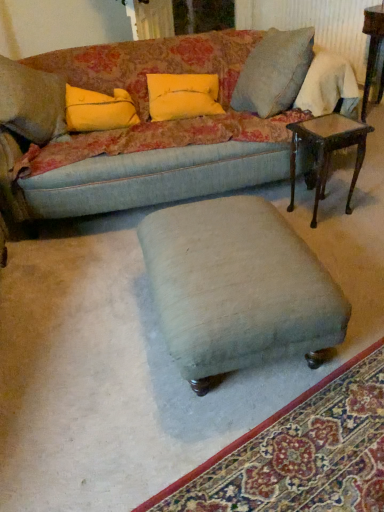
Question: Can you confirm if velvet green ottoman at center is thinner than velvet green ottoman at center?

Choices:
 (A) no
 (B) yes

Answer: (A)

Question: Can you confirm if velvet green ottoman at center is bigger than velvet green ottoman at center?

Choices:
 (A) no
 (B) yes

Answer: (B)

Question: Is velvet green ottoman at center behind velvet green ottoman at center?

Choices:
 (A) no
 (B) yes

Answer: (B)

Question: Considering the relative sizes of velvet green ottoman at center and velvet green ottoman at center in the image provided, is velvet green ottoman at center wider than velvet green ottoman at center?

Choices:
 (A) no
 (B) yes

Answer: (B)

Question: From a real-world perspective, does velvet green ottoman at center stand above velvet green ottoman at center?

Choices:
 (A) no
 (B) yes

Answer: (B)

Question: Does point (317, 423) appear closer or farther from the camera than point (77, 120)?

Choices:
 (A) farther
 (B) closer

Answer: (B)

Question: Is velvet green ottoman at center in front of or behind yellow fabric pillow at upper left, which ranks as the first pillow in left-to-right order, in the image?

Choices:
 (A) behind
 (B) front

Answer: (B)

Question: Is velvet green ottoman at center situated inside yellow fabric pillow at upper left, which ranks as the first pillow in left-to-right order, or outside?

Choices:
 (A) outside
 (B) inside

Answer: (A)

Question: From the image's perspective, is velvet green ottoman at center located above or below yellow fabric pillow at upper left, the 2th pillow from the right?

Choices:
 (A) below
 (B) above

Answer: (A)

Question: Considering the relative positions of velvet green ottoman at center and mahogany wood side table at right, which is the second table from back to front, in the image provided, is velvet green ottoman at center to the left or to the right of mahogany wood side table at right, which is the second table from back to front,?

Choices:
 (A) left
 (B) right

Answer: (A)

Question: Is velvet green ottoman at center wider or thinner than mahogany wood side table at right, placed as the first table when sorted from left to right?

Choices:
 (A) thin
 (B) wide

Answer: (B)

Question: From the image's perspective, is velvet green ottoman at center above or below mahogany wood side table at right, placed as the first table when sorted from left to right?

Choices:
 (A) below
 (B) above

Answer: (A)

Question: Is velvet green ottoman at center in front of or behind mahogany wood side table at right, which is the second table from back to front, in the image?

Choices:
 (A) front
 (B) behind

Answer: (A)

Question: From their relative heights in the image, would you say yellow fabric pillow at upper left, which ranks as the first pillow in left-to-right order, is taller or shorter than mahogany wood side table at right, the 2th table when ordered from right to left?

Choices:
 (A) tall
 (B) short

Answer: (B)

Question: Is yellow fabric pillow at upper left, the 2th pillow from the right, inside the boundaries of mahogany wood side table at right, which is the first table from front to back, or outside?

Choices:
 (A) outside
 (B) inside

Answer: (A)